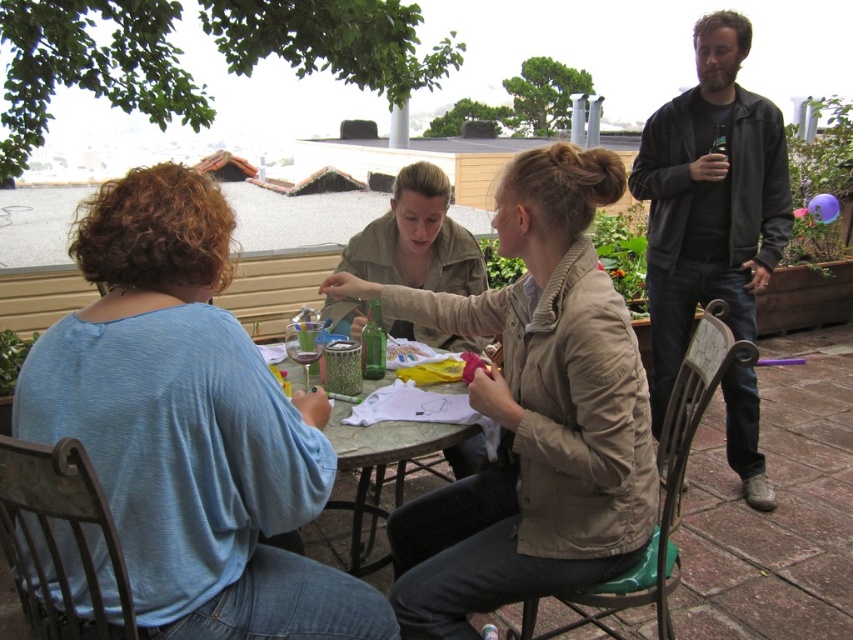
Question: In this image, where is light blue jersey at left located relative to marble-patterned table at center?

Choices:
 (A) below
 (B) above

Answer: (B)

Question: Which object appears closest to the camera in this image?

Choices:
 (A) dark gray leather jacket at right
 (B) matte beige jacket at center
 (C) marble-patterned table at center
 (D) khaki cotton jacket at center

Answer: (B)

Question: Which object is the closest to the khaki cotton jacket at center?

Choices:
 (A) light blue jersey at left
 (B) matte beige jacket at center
 (C) dark gray leather jacket at right
 (D) marble-patterned table at center

Answer: (B)

Question: Among these objects, which one is farthest from the camera?

Choices:
 (A) light blue jersey at left
 (B) khaki cotton jacket at center
 (C) dark gray leather jacket at right

Answer: (C)

Question: Is light blue jersey at left positioned before marble-patterned table at center?

Choices:
 (A) no
 (B) yes

Answer: (B)

Question: Does light blue jersey at left appear over matte beige jacket at center?

Choices:
 (A) no
 (B) yes

Answer: (A)